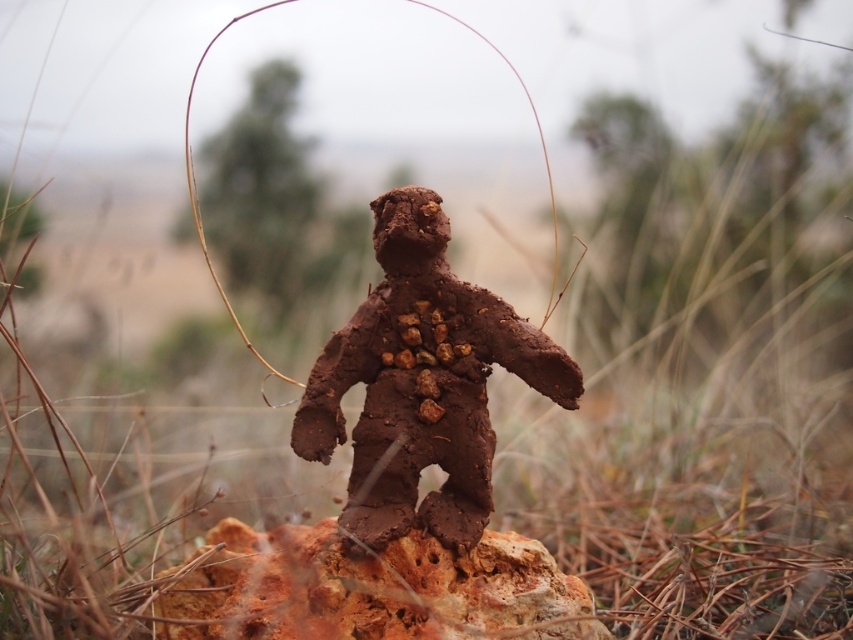
You are a drone operator trying to capture aerial footage of the clay figure. You notice two points in the image labeled as point 1 and point 2. If point 1 is at coordinates point (374, 390) and point 2 is at point (357, 563), which point is closer to the camera based on their positions?

Point 2 at coordinates point (357, 563) is closer to the camera because point 1 at coordinates point (374, 390) is behind it.

You are an archaeologist examining the scene. The dull brown clay figure at center is positioned in the image. Can you determine its exact coordinates based on the image grid?

The dull brown clay figure at center is located at point (421,384), so its coordinates are 0.600 on the x axis and 0.495 on the y axis.

You are a geologist examining the image. You notice a point at coordinates (421, 384). What object is located at this point?

The dull brown clay figure at center is located at point (421, 384).